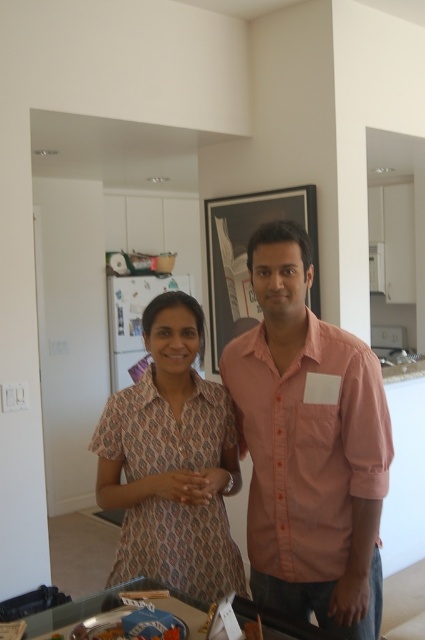
Question: Which object appears farthest from the camera in this image?

Choices:
 (A) dull pink printed blouse at center
 (B) pink cotton shirt at center

Answer: (B)

Question: Which object appears closest to the camera in this image?

Choices:
 (A) pink cotton shirt at center
 (B) dull pink printed blouse at center

Answer: (B)

Question: Where is pink cotton shirt at center located in relation to dull pink printed blouse at center in the image?

Choices:
 (A) above
 (B) below

Answer: (A)

Question: Is pink cotton shirt at center positioned before dull pink printed blouse at center?

Choices:
 (A) no
 (B) yes

Answer: (A)

Question: Can you confirm if pink cotton shirt at center is positioned to the left of dull pink printed blouse at center?

Choices:
 (A) yes
 (B) no

Answer: (B)

Question: Among these points, which one is nearest to the camera?

Choices:
 (A) (362, 442)
 (B) (136, 573)

Answer: (A)